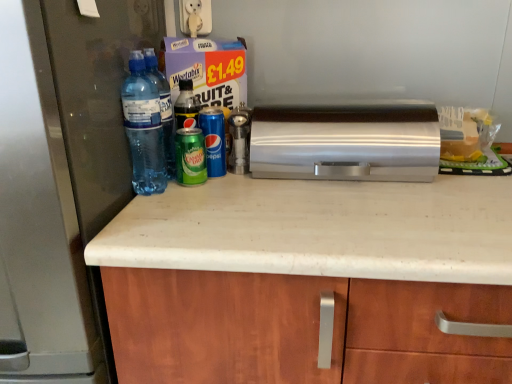
Question: Does silver metallic bread bin at center have a larger size compared to blue metallic can at center, positioned as the third bottle in left-to-right order?

Choices:
 (A) yes
 (B) no

Answer: (A)

Question: Does silver metallic bread bin at center lie behind blue metallic can at center, which is counted as the first bottle, starting from the right?

Choices:
 (A) no
 (B) yes

Answer: (A)

Question: From the image's perspective, is silver metallic bread bin at center on blue metallic can at center, positioned as the third bottle in left-to-right order?

Choices:
 (A) yes
 (B) no

Answer: (A)

Question: Could you tell me if silver metallic bread bin at center is turned towards blue metallic can at center, positioned as the third bottle in left-to-right order?

Choices:
 (A) no
 (B) yes

Answer: (A)

Question: Can you confirm if silver metallic bread bin at center is taller than blue metallic can at center, which is counted as the first bottle, starting from the right?

Choices:
 (A) no
 (B) yes

Answer: (A)

Question: From the image's perspective, is green matte can at center, arranged as the 2th bottle when viewed from the right, positioned above or below blue metallic can at center, positioned as the third bottle in left-to-right order?

Choices:
 (A) above
 (B) below

Answer: (A)

Question: Would you say green matte can at center, arranged as the 2th bottle when viewed from the right, is to the left or to the right of blue metallic can at center, which is counted as the first bottle, starting from the right, in the picture?

Choices:
 (A) left
 (B) right

Answer: (A)

Question: Looking at the image, does green matte can at center, the second bottle when ordered from left to right, seem bigger or smaller compared to blue metallic can at center, positioned as the third bottle in left-to-right order?

Choices:
 (A) small
 (B) big

Answer: (B)

Question: Is point (185, 82) positioned closer to the camera than point (223, 158)?

Choices:
 (A) closer
 (B) farther

Answer: (B)

Question: Relative to silver metallic bread bin at center, is blue metallic can at center, positioned as the third bottle in left-to-right order, in front or behind?

Choices:
 (A) behind
 (B) front

Answer: (A)

Question: Looking at the image, does blue metallic can at center, which is counted as the first bottle, starting from the right, seem bigger or smaller compared to silver metallic bread bin at center?

Choices:
 (A) small
 (B) big

Answer: (A)

Question: From a real-world perspective, is blue metallic can at center, which is counted as the first bottle, starting from the right, above or below silver metallic bread bin at center?

Choices:
 (A) above
 (B) below

Answer: (B)

Question: Which is correct: blue metallic can at center, positioned as the third bottle in left-to-right order, is inside silver metallic bread bin at center, or outside of it?

Choices:
 (A) outside
 (B) inside

Answer: (A)

Question: Is transparent plastic water bottles at left, the 1th bottle positioned from the left, in front of or behind metallic silver shaker at center in the image?

Choices:
 (A) behind
 (B) front

Answer: (B)

Question: From the image's perspective, is transparent plastic water bottles at left, the 1th bottle positioned from the left, above or below metallic silver shaker at center?

Choices:
 (A) below
 (B) above

Answer: (B)